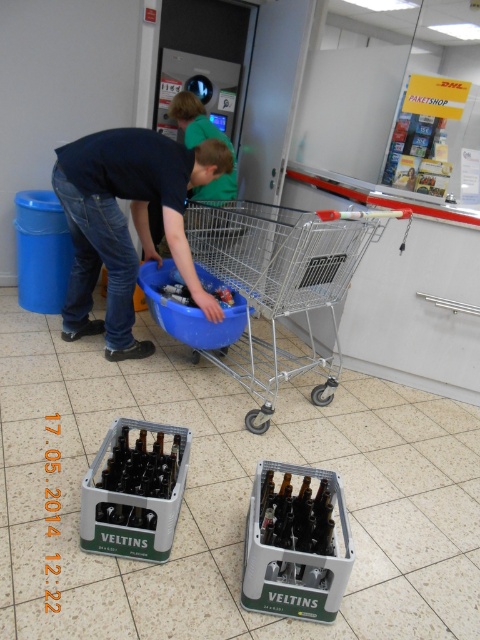
Question: Which point appears closest to the camera in this image?

Choices:
 (A) (251, 291)
 (B) (135, 160)

Answer: (B)

Question: Does silver metallic shopping cart at center appear under dark blue jeans at lower left?

Choices:
 (A) yes
 (B) no

Answer: (A)

Question: Which object appears closest to the camera in this image?

Choices:
 (A) dark blue jeans at lower left
 (B) silver metallic shopping cart at center

Answer: (B)

Question: Does silver metallic shopping cart at center appear over dark blue jeans at lower left?

Choices:
 (A) yes
 (B) no

Answer: (B)

Question: Can you confirm if silver metallic shopping cart at center is thinner than dark blue jeans at lower left?

Choices:
 (A) yes
 (B) no

Answer: (B)